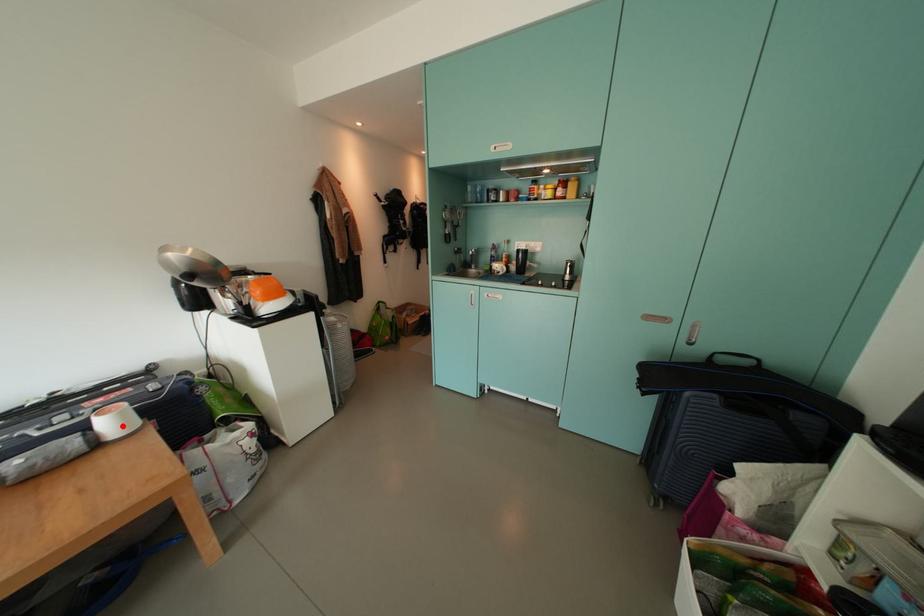
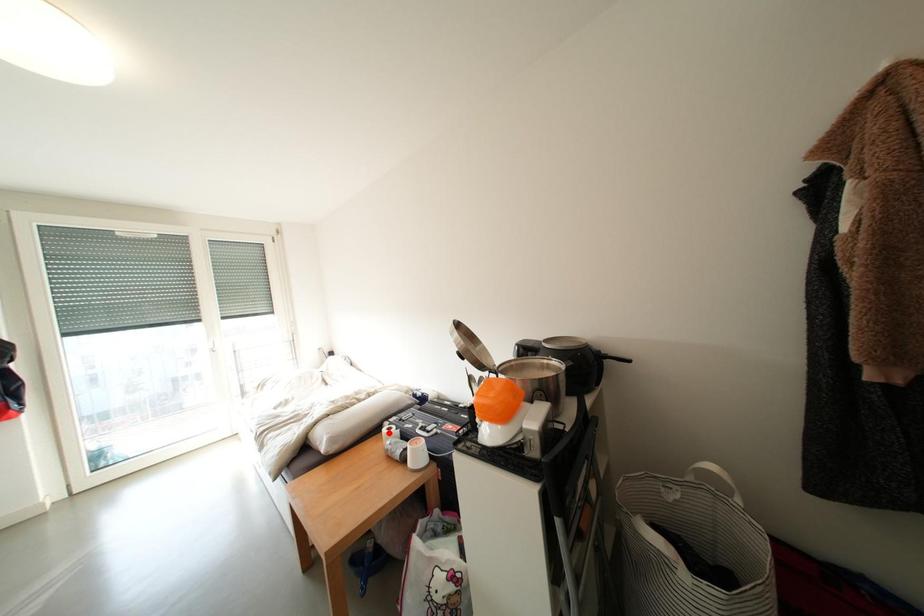
I am providing you with two images of the same scene from different viewpoints. A red point is marked on the first image and another point is marked on the second image. Do the highlighted points in image1 and image2 indicate the same real-world spot?

No